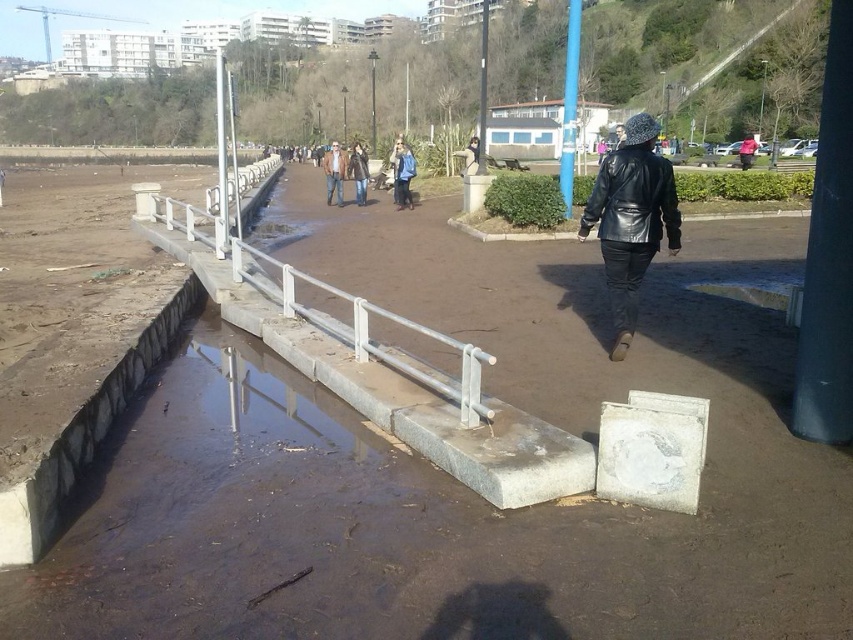
Question: Which object is farther from the camera taking this photo?

Choices:
 (A) leather jacket at center
 (B) matte black jacket at center
 (C) matte pink shirt at center

Answer: (C)

Question: Can you confirm if blue denim jacket at center is positioned to the right of matte pink shirt at center?

Choices:
 (A) no
 (B) yes

Answer: (A)

Question: Does black leather jacket at center come in front of matte pink shirt at center?

Choices:
 (A) no
 (B) yes

Answer: (B)

Question: Which of the following is the farthest from the observer?

Choices:
 (A) (477, 168)
 (B) (605, 156)
 (C) (407, 196)

Answer: (B)

Question: Is the position of black leather jacket at center less distant than that of matte black jacket at center?

Choices:
 (A) no
 (B) yes

Answer: (B)

Question: Which object appears closest to the camera in this image?

Choices:
 (A) matte black jacket at center
 (B) black leather jacket at center
 (C) leather jacket at center
 (D) denim jacket at center

Answer: (B)